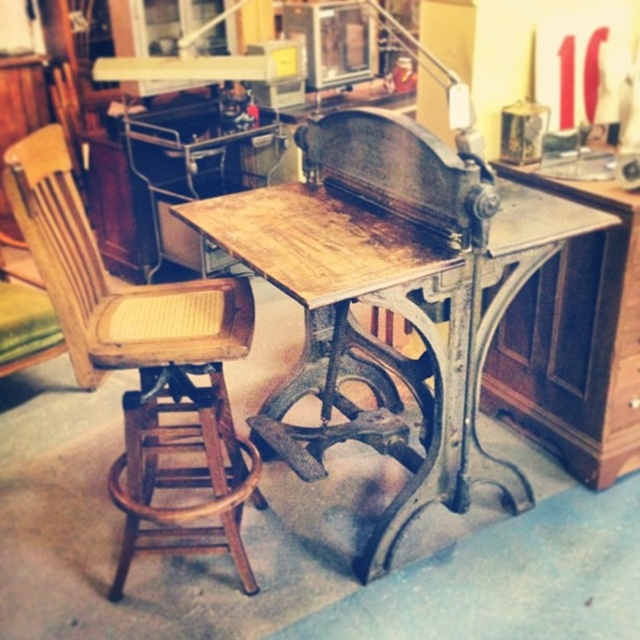
You are a customer in an antique shop and want to sit down to examine the sewing machine. The wooden table at center is in your way. Can you move around it to reach the wooden cane seat at left?

The wooden table at center is positioned under the wooden cane seat at left, so you can move around the table to reach the wooden cane seat at left since it is not blocking the path directly underneath.

You are standing in front of the vintage sewing machine setup. There is a point labeled at coordinates (397, 314). What object does this point correspond to?

The point labeled at coordinates (397, 314) corresponds to the wooden table at center.